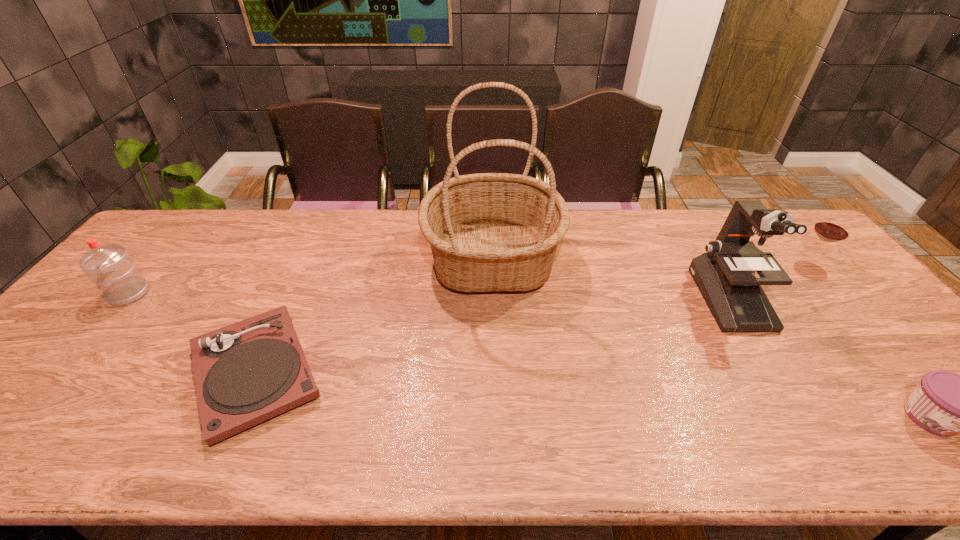
What are the coordinates of `vacant area that satisfies the following two spatial constraints: 1. on the handle side of the fifth object from right to left; 2. on the left side of the leftmost object` in the screenshot? It's located at tap(61, 373).

Where is `free location that satisfies the following two spatial constraints: 1. on the front side of the basket; 2. on the handle side of the fourth shortest object`? This screenshot has width=960, height=540. free location that satisfies the following two spatial constraints: 1. on the front side of the basket; 2. on the handle side of the fourth shortest object is located at coordinates (493, 294).

Where is `blank area in the image that satisfies the following two spatial constraints: 1. on the back side of the second object from left to right; 2. on the right side of the fourth tallest object`? The width and height of the screenshot is (960, 540). blank area in the image that satisfies the following two spatial constraints: 1. on the back side of the second object from left to right; 2. on the right side of the fourth tallest object is located at coordinates (305, 262).